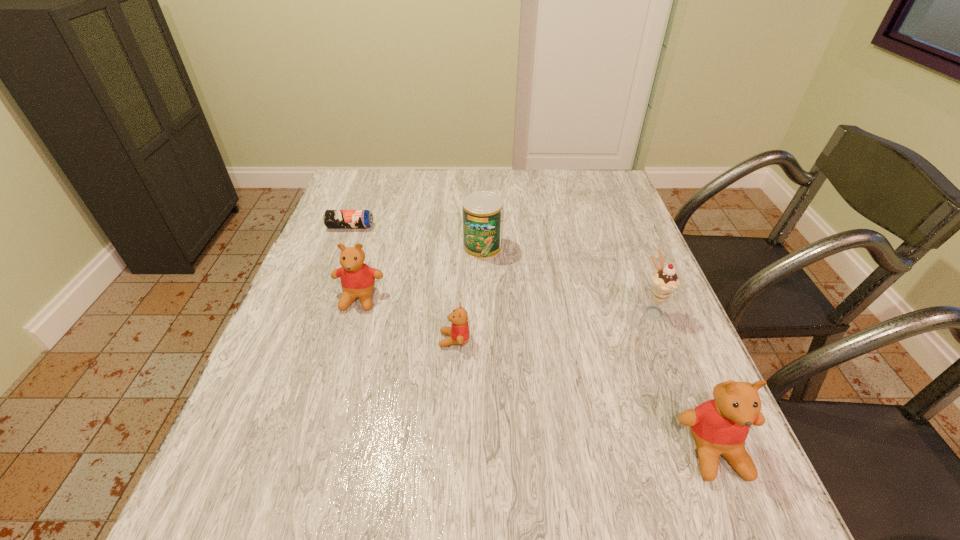
At what (x,y) coordinates should I click in order to perform the action: click on teddy bear that is at the right edge. Please return your answer as a coordinate pair (x, y). Image resolution: width=960 pixels, height=540 pixels. Looking at the image, I should click on 720,426.

In order to click on icecream located in the right edge section of the desktop in this screenshot , I will do `click(664, 282)`.

Where is `object situated at the near right corner`? object situated at the near right corner is located at coordinates (720, 426).

At what (x,y) coordinates should I click in order to perform the action: click on vacant area at the far edge. Please return your answer as a coordinate pair (x, y). The image size is (960, 540). Looking at the image, I should click on (538, 172).

Locate an element on the screen. The image size is (960, 540). free space at the near edge is located at coordinates (501, 419).

In the image, there is a desktop. At what (x,y) coordinates should I click in order to perform the action: click on blank space at the left edge. Please return your answer as a coordinate pair (x, y). Looking at the image, I should click on (278, 341).

At what (x,y) coordinates should I click in order to perform the action: click on vacant area at the right edge of the desktop. Please return your answer as a coordinate pair (x, y). The height and width of the screenshot is (540, 960). Looking at the image, I should click on (698, 398).

In the image, there is a desktop. Where is `vacant region at the far left corner`? Image resolution: width=960 pixels, height=540 pixels. vacant region at the far left corner is located at coordinates (391, 178).

You are a GUI agent. You are given a task and a screenshot of the screen. Output one action in this format:
    pyautogui.click(x=<x>, y=<y>)
    Task: Click on the vacant space in between the shortest object and the second farthest teddy bear
    Image resolution: width=960 pixels, height=540 pixels.
    Given the screenshot: What is the action you would take?
    pyautogui.click(x=402, y=283)

This screenshot has width=960, height=540. Identify the location of free space between the second nearest object and the farthest object. (402, 283).